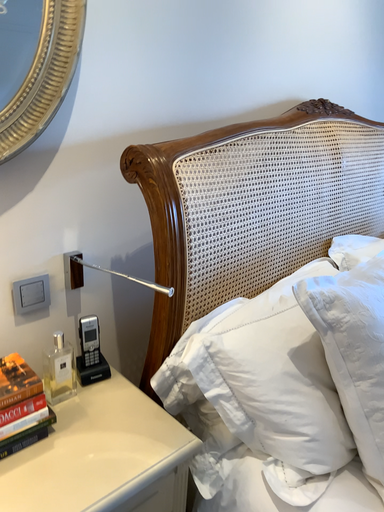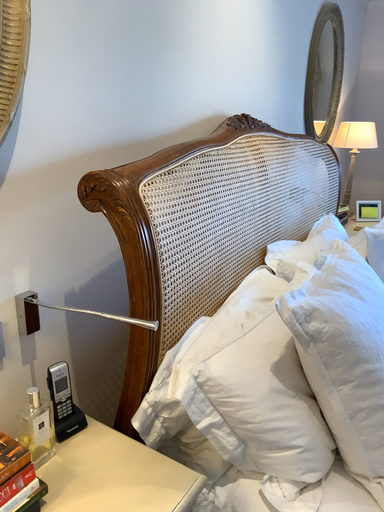
Question: How did the camera likely rotate when shooting the video?

Choices:
 (A) rotated right
 (B) rotated left

Answer: (A)